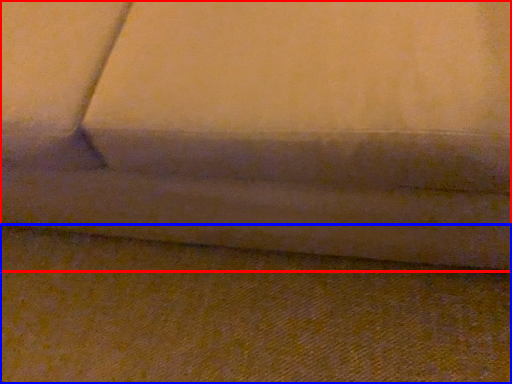
Question: Which of the following is the closest to the observer, studio couch (highlighted by a red box) or surface (highlighted by a blue box)?

Choices:
 (A) studio couch
 (B) surface

Answer: (A)